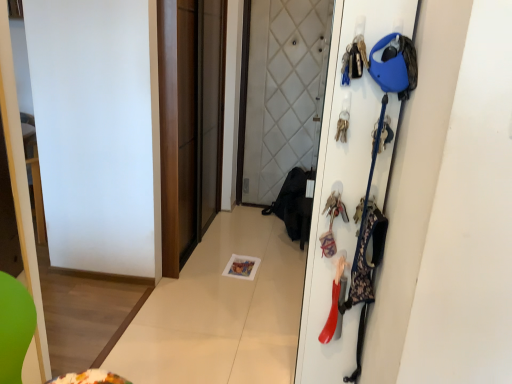
Locate an element on the screen. free location to the right of brown matte sliding door at center is located at coordinates (x=248, y=248).